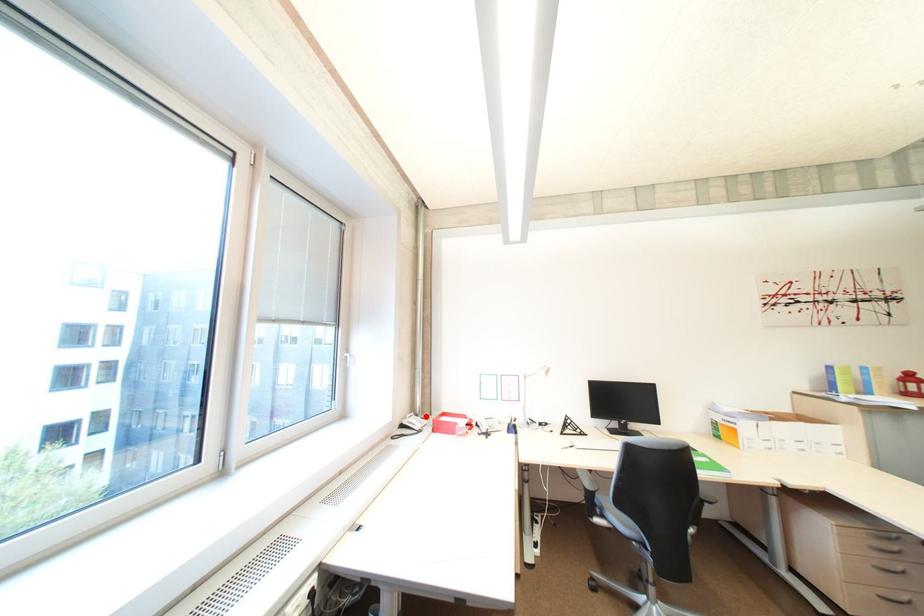
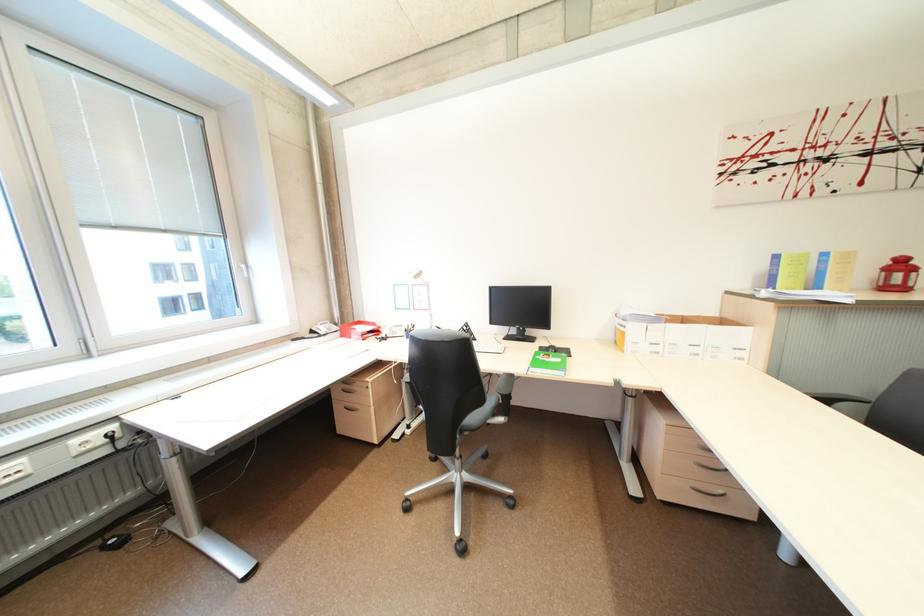
In the second image, find the point that corresponds to the highlighted location in the first image.

(345, 325)